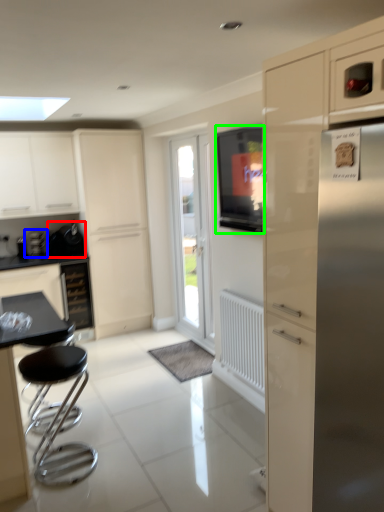
Question: Considering the real-world distances, which object is closest to appliance (highlighted by a red box)? coffee machine (highlighted by a blue box) or window screen (highlighted by a green box).

Choices:
 (A) coffee machine
 (B) window screen

Answer: (A)